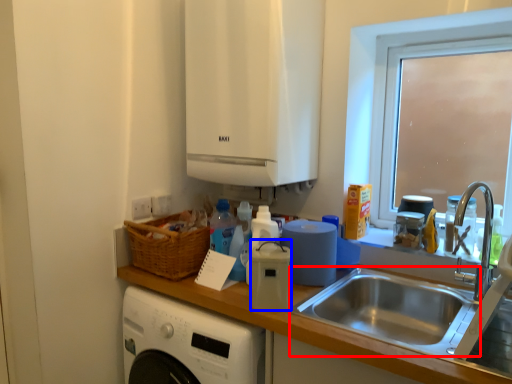
Question: Among these objects, which one is farthest to the camera, sink (highlighted by a red box) or appliance (highlighted by a blue box)?

Choices:
 (A) sink
 (B) appliance

Answer: (B)